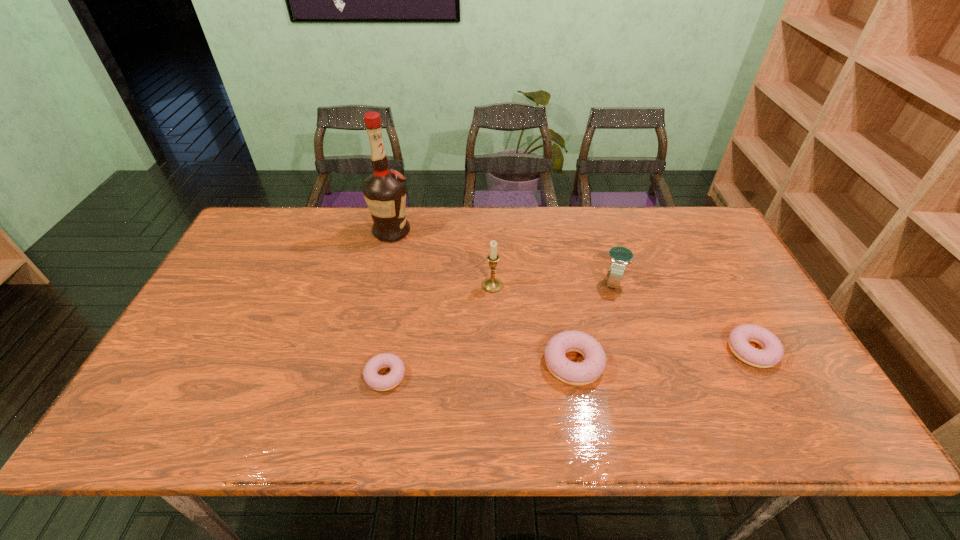
This screenshot has height=540, width=960. In order to click on the leftmost doughnut in this screenshot , I will do `click(377, 382)`.

At what (x,y) coordinates should I click in order to perform the action: click on the shortest doughnut. Please return your answer as a coordinate pair (x, y). Looking at the image, I should click on (377, 382).

This screenshot has height=540, width=960. Identify the location of the fourth object from left to right. (594, 363).

Where is `the tallest doughnut`? the tallest doughnut is located at coordinates coord(594,363).

Identify the location of the fifth tallest object. This screenshot has width=960, height=540. (772, 353).

Where is `the rightmost object`? This screenshot has width=960, height=540. the rightmost object is located at coordinates (772, 353).

Locate an element on the screen. The width and height of the screenshot is (960, 540). liquor is located at coordinates (384, 191).

This screenshot has height=540, width=960. I want to click on the farthest object, so click(x=384, y=191).

Locate an element on the screen. the fourth object from right to left is located at coordinates (492, 285).

Where is `candle holder`? candle holder is located at coordinates (492, 285).